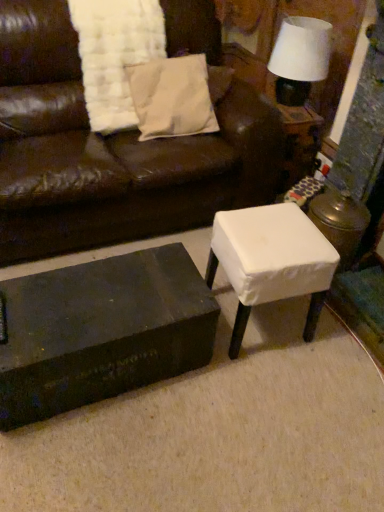
This screenshot has width=384, height=512. What are the coordinates of `free point above black matte/wooden coffee table at lower left (from a real-world perspective)` in the screenshot? It's located at (81, 303).